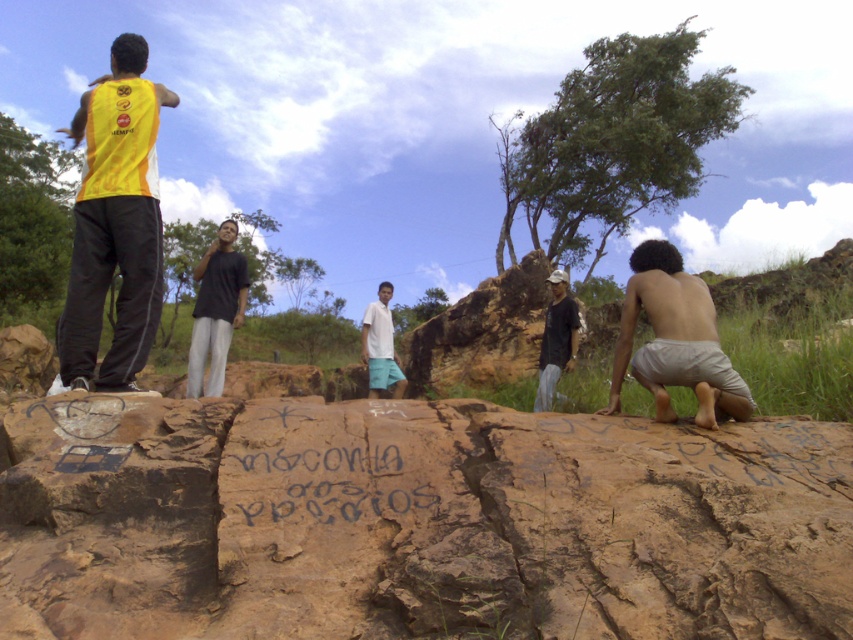
Question: Does brown rough rock at center have a smaller size compared to white cotton shirt at center?

Choices:
 (A) yes
 (B) no

Answer: (A)

Question: Does yellow fabric shirt at left have a lesser width compared to dark gray cotton shirt at center?

Choices:
 (A) no
 (B) yes

Answer: (A)

Question: Which of the following is the farthest from the observer?

Choices:
 (A) (125, 268)
 (B) (233, 298)
 (C) (392, 321)
 (D) (300, 461)

Answer: (C)

Question: Estimate the real-world distances between objects in this image. Which object is farther from the dark gray fabric shirt at center?

Choices:
 (A) light beige shorts at lower right
 (B) brown rough rock at center
 (C) white cotton shirt at center
 (D) yellow fabric shirt at left

Answer: (D)

Question: Can you confirm if yellow fabric shirt at left is thinner than white cotton shirt at center?

Choices:
 (A) yes
 (B) no

Answer: (B)

Question: Which point is closer to the camera?

Choices:
 (A) light beige shorts at lower right
 (B) white cotton shirt at center

Answer: (A)